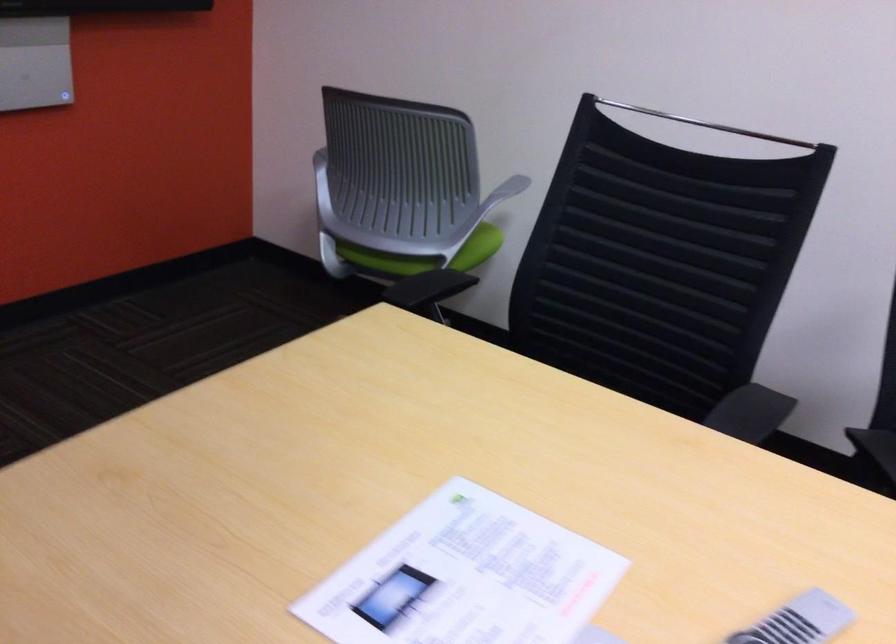
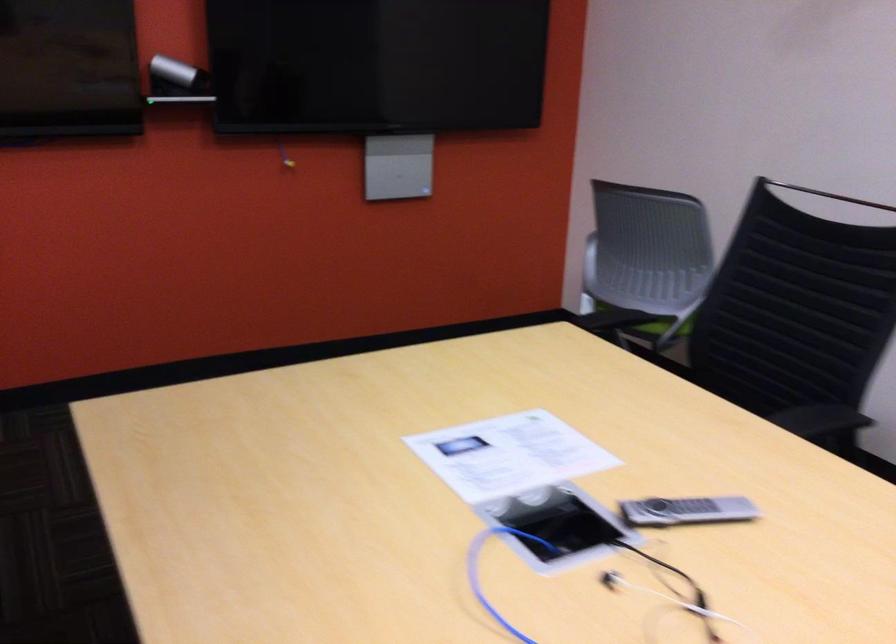
Where in the second image is the point corresponding to point (424, 270) from the first image?

(653, 325)